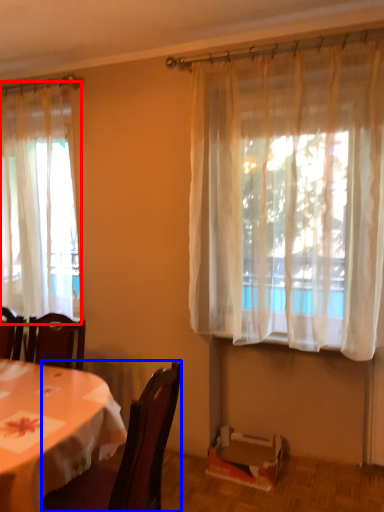
Question: Which object appears closest to the camera in this image, curtain (highlighted by a red box) or chair (highlighted by a blue box)?

Choices:
 (A) curtain
 (B) chair

Answer: (B)